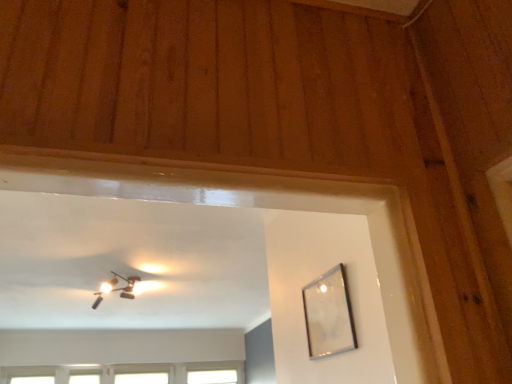
Question: Is white glass window at upper center, which appears as the first window when viewed from the right, in front of transparent glass window at lower left, the 3th window when ordered from right to left?

Choices:
 (A) yes
 (B) no

Answer: (B)

Question: From a real-world perspective, is white glass window at upper center, which appears as the first window when viewed from the right, beneath transparent glass window at lower left, the 3th window when ordered from right to left?

Choices:
 (A) yes
 (B) no

Answer: (B)

Question: Is white glass window at upper center, which appears as the first window when viewed from the right, not near transparent glass window at lower left, the 2th window when ordered from left to right?

Choices:
 (A) no
 (B) yes

Answer: (B)

Question: Can you confirm if white glass window at upper center, which ranks as the fourth window in left-to-right order, is taller than transparent glass window at lower left, the 2th window when ordered from left to right?

Choices:
 (A) yes
 (B) no

Answer: (A)

Question: Does white glass window at upper center, which ranks as the fourth window in left-to-right order, have a greater width compared to transparent glass window at lower left, the 2th window when ordered from left to right?

Choices:
 (A) no
 (B) yes

Answer: (A)

Question: From the image's perspective, is white glass window at upper center, which ranks as the fourth window in left-to-right order, located beneath transparent glass window at lower left, the 2th window when ordered from left to right?

Choices:
 (A) no
 (B) yes

Answer: (B)

Question: Does transparent glass window at lower left, marked as the fourth window in a right-to-left arrangement, have a lesser width compared to white glass window at upper center, which appears as the first window when viewed from the right?

Choices:
 (A) no
 (B) yes

Answer: (B)

Question: From a real-world perspective, is transparent glass window at lower left, acting as the first window starting from the left, beneath white glass window at upper center, which appears as the first window when viewed from the right?

Choices:
 (A) no
 (B) yes

Answer: (A)

Question: Does transparent glass window at lower left, acting as the first window starting from the left, appear on the right side of white glass window at upper center, which appears as the first window when viewed from the right?

Choices:
 (A) no
 (B) yes

Answer: (A)

Question: Can you confirm if transparent glass window at lower left, acting as the first window starting from the left, is smaller than white glass window at upper center, which ranks as the fourth window in left-to-right order?

Choices:
 (A) yes
 (B) no

Answer: (A)

Question: Is transparent glass window at lower left, acting as the first window starting from the left, to the left of white glass window at upper center, which ranks as the fourth window in left-to-right order, from the viewer's perspective?

Choices:
 (A) no
 (B) yes

Answer: (B)

Question: Considering the relative sizes of transparent glass window at lower left, marked as the fourth window in a right-to-left arrangement, and white glass window at upper center, which ranks as the fourth window in left-to-right order, in the image provided, is transparent glass window at lower left, marked as the fourth window in a right-to-left arrangement, shorter than white glass window at upper center, which ranks as the fourth window in left-to-right order,?

Choices:
 (A) yes
 (B) no

Answer: (A)

Question: Is clear glass picture frame at upper right smaller than matte black fixture at upper center?

Choices:
 (A) yes
 (B) no

Answer: (A)